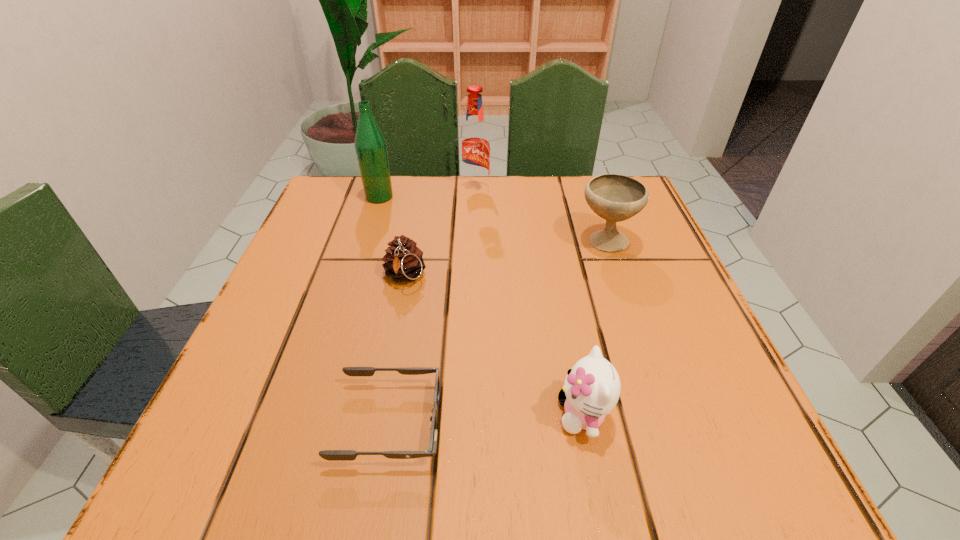
Image resolution: width=960 pixels, height=540 pixels. In order to click on sunglasses at the near edge in this screenshot , I will do `click(331, 455)`.

Where is `object positioned at the left edge`? This screenshot has width=960, height=540. object positioned at the left edge is located at coordinates (370, 144).

Locate an element on the screen. This screenshot has width=960, height=540. object present at the right edge is located at coordinates (613, 197).

Locate an element on the screen. object positioned at the far left corner is located at coordinates (370, 144).

At what (x,y) coordinates should I click in order to perform the action: click on object located in the far right corner section of the desktop. Please return your answer as a coordinate pair (x, y). Looking at the image, I should click on (613, 197).

Where is `vacant area at the far edge`? vacant area at the far edge is located at coordinates (547, 201).

Locate an element on the screen. The image size is (960, 540). free space at the near edge is located at coordinates (438, 431).

The height and width of the screenshot is (540, 960). What are the coordinates of `vacant area at the left edge of the desktop` in the screenshot? It's located at (256, 365).

Locate an element on the screen. vacant space at the right edge is located at coordinates (669, 341).

In the image, there is a desktop. At what (x,y) coordinates should I click in order to perform the action: click on free space at the near left corner. Please return your answer as a coordinate pair (x, y). The height and width of the screenshot is (540, 960). Looking at the image, I should click on click(236, 427).